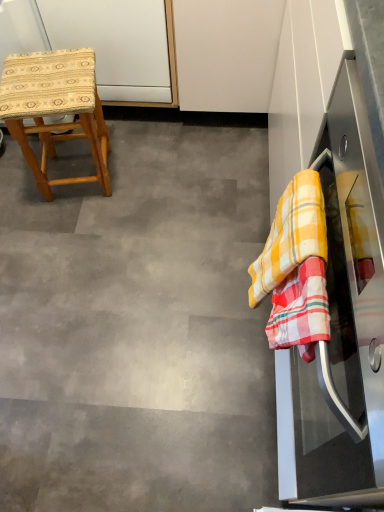
Question: Considering the relative sizes of wooden woven stool at left and yellow checkered cloth at right in the image provided, is wooden woven stool at left bigger than yellow checkered cloth at right?

Choices:
 (A) yes
 (B) no

Answer: (A)

Question: Is wooden woven stool at left thinner than yellow checkered cloth at right?

Choices:
 (A) no
 (B) yes

Answer: (A)

Question: Is the position of wooden woven stool at left more distant than that of yellow checkered cloth at right?

Choices:
 (A) no
 (B) yes

Answer: (B)

Question: Would you say wooden woven stool at left is outside yellow checkered cloth at right?

Choices:
 (A) yes
 (B) no

Answer: (A)

Question: From the image's perspective, is wooden woven stool at left over yellow checkered cloth at right?

Choices:
 (A) yes
 (B) no

Answer: (A)

Question: Choose the correct answer: Is stainless steel oven at right inside wooden woven stool at left or outside it?

Choices:
 (A) outside
 (B) inside

Answer: (A)

Question: Considering the positions of point (339, 158) and point (87, 136), is point (339, 158) closer or farther from the camera than point (87, 136)?

Choices:
 (A) farther
 (B) closer

Answer: (B)

Question: Relative to wooden woven stool at left, is stainless steel oven at right in front or behind?

Choices:
 (A) front
 (B) behind

Answer: (A)

Question: Is stainless steel oven at right bigger or smaller than wooden woven stool at left?

Choices:
 (A) small
 (B) big

Answer: (B)

Question: Visually, is wooden woven stool at left positioned to the left or to the right of gray matte floor at center?

Choices:
 (A) left
 (B) right

Answer: (A)

Question: In the image, is wooden woven stool at left positioned in front of or behind gray matte floor at center?

Choices:
 (A) front
 (B) behind

Answer: (B)

Question: Is point (107, 168) closer or farther from the camera than point (139, 317)?

Choices:
 (A) closer
 (B) farther

Answer: (B)

Question: From the image's perspective, is wooden woven stool at left positioned above or below gray matte floor at center?

Choices:
 (A) above
 (B) below

Answer: (A)

Question: From a real-world perspective, relative to stainless steel oven at right, is wooden woven stool at left vertically above or below?

Choices:
 (A) below
 (B) above

Answer: (A)

Question: Is wooden woven stool at left inside or outside of stainless steel oven at right?

Choices:
 (A) inside
 (B) outside

Answer: (B)